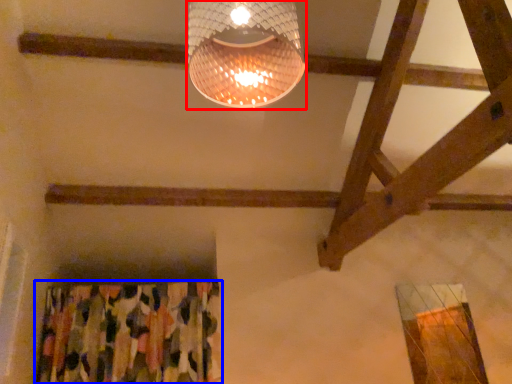
Question: Which object is closer to the camera taking this photo, lamp (highlighted by a red box) or curtain (highlighted by a blue box)?

Choices:
 (A) lamp
 (B) curtain

Answer: (A)